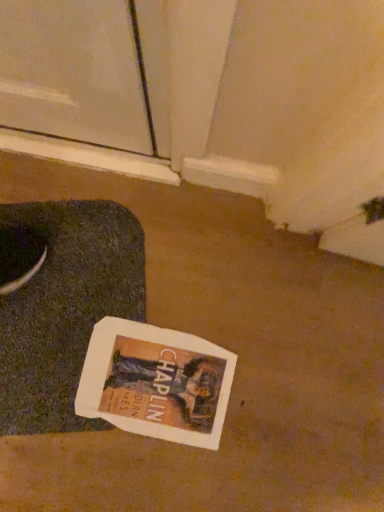
Image resolution: width=384 pixels, height=512 pixels. What do you see at coordinates (62, 304) in the screenshot?
I see `dark gray textured yoga mat at lower left` at bounding box center [62, 304].

In order to click on dark gray textured yoga mat at lower left in this screenshot , I will do `click(62, 304)`.

In order to click on white paper magazine at center in this screenshot , I will do `click(156, 382)`.

What do you see at coordinates (156, 382) in the screenshot? Image resolution: width=384 pixels, height=512 pixels. I see `white paper magazine at center` at bounding box center [156, 382].

The image size is (384, 512). What are the coordinates of `dark gray textured yoga mat at lower left` in the screenshot? It's located at (62, 304).

Between dark gray textured yoga mat at lower left and white paper magazine at center, which one appears on the right side from the viewer's perspective?

From the viewer's perspective, white paper magazine at center appears more on the right side.

Looking at this image, relative to white paper magazine at center, is dark gray textured yoga mat at lower left in front or behind?

Visually, dark gray textured yoga mat at lower left is located in front of white paper magazine at center.

Considering the points (84, 419) and (233, 373), which point is in front, point (84, 419) or point (233, 373)?

The point (84, 419) is more forward.

From the image's perspective, is dark gray textured yoga mat at lower left located beneath white paper magazine at center?

No, from the image's perspective, dark gray textured yoga mat at lower left is not below white paper magazine at center.

From a real-world perspective, is dark gray textured yoga mat at lower left positioned above or below white paper magazine at center?

dark gray textured yoga mat at lower left is above white paper magazine at center.

Which object is thinner, dark gray textured yoga mat at lower left or white paper magazine at center?

white paper magazine at center.

Is dark gray textured yoga mat at lower left taller or shorter than white paper magazine at center?

In the image, dark gray textured yoga mat at lower left appears to be taller than white paper magazine at center.

Can you confirm if dark gray textured yoga mat at lower left is bigger than white paper magazine at center?

Indeed, dark gray textured yoga mat at lower left has a larger size compared to white paper magazine at center.

Would you say white paper magazine at center is part of dark gray textured yoga mat at lower left's contents?

Yes, dark gray textured yoga mat at lower left contains white paper magazine at center.

Is dark gray textured yoga mat at lower left far away from white paper magazine at center?

No.

Is dark gray textured yoga mat at lower left facing away from white paper magazine at center?

No, dark gray textured yoga mat at lower left is not facing the opposite direction of white paper magazine at center.

What's the angular difference between dark gray textured yoga mat at lower left and white paper magazine at center's facing directions?

The angle between the facing direction of dark gray textured yoga mat at lower left and the facing direction of white paper magazine at center is 105 degrees.

Identify the location of magazine that is on the right side of dark gray textured yoga mat at lower left. (156, 382).

Visually, is white paper magazine at center positioned to the left or to the right of dark gray textured yoga mat at lower left?

In the image, white paper magazine at center appears on the right side of dark gray textured yoga mat at lower left.

Who is more distant, white paper magazine at center or dark gray textured yoga mat at lower left?

white paper magazine at center.

Considering the points (126, 423) and (8, 258), which point is behind, point (126, 423) or point (8, 258)?

The point (126, 423) is farther from the camera.

From the image's perspective, which is below, white paper magazine at center or dark gray textured yoga mat at lower left?

white paper magazine at center, from the image's perspective.

From a real-world perspective, is white paper magazine at center over dark gray textured yoga mat at lower left?

No, from a real-world perspective, white paper magazine at center is not above dark gray textured yoga mat at lower left.

Which object is thinner, white paper magazine at center or dark gray textured yoga mat at lower left?

Thinner between the two is white paper magazine at center.

Consider the image. In terms of height, does white paper magazine at center look taller or shorter compared to dark gray textured yoga mat at lower left?

Considering their sizes, white paper magazine at center has less height than dark gray textured yoga mat at lower left.

Considering the sizes of objects white paper magazine at center and dark gray textured yoga mat at lower left in the image provided, who is smaller, white paper magazine at center or dark gray textured yoga mat at lower left?

white paper magazine at center.

Would you say dark gray textured yoga mat at lower left is part of white paper magazine at center's contents?

Actually, dark gray textured yoga mat at lower left is outside white paper magazine at center.

Are white paper magazine at center and dark gray textured yoga mat at lower left far apart?

No.

Is white paper magazine at center turned away from dark gray textured yoga mat at lower left?

No, white paper magazine at center is not facing the opposite direction of dark gray textured yoga mat at lower left.

Based on the photo, how many degrees apart are the facing directions of white paper magazine at center and dark gray textured yoga mat at lower left?

white paper magazine at center and dark gray textured yoga mat at lower left are facing 105 degrees away from each other.

Where is `yoga mat that is in front of the white paper magazine at center`? The width and height of the screenshot is (384, 512). yoga mat that is in front of the white paper magazine at center is located at coordinates (62, 304).

The width and height of the screenshot is (384, 512). In order to click on magazine on the right of the dark gray textured yoga mat at lower left in this screenshot , I will do `click(156, 382)`.

Identify the location of magazine beneath the dark gray textured yoga mat at lower left (from a real-world perspective). pyautogui.click(x=156, y=382).